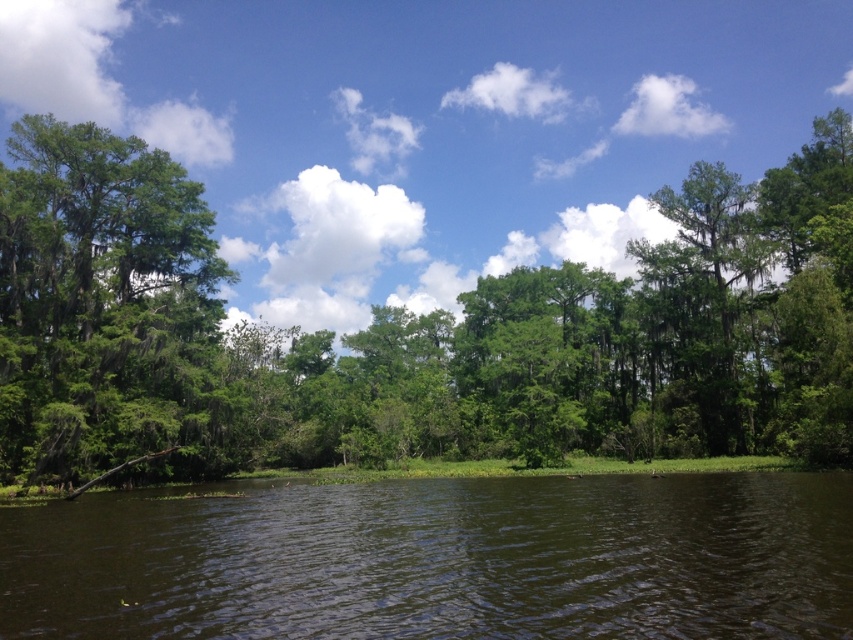
Looking at this image, does green leafy forest at center appear on the right side of green mossy tree at left?

Yes, green leafy forest at center is to the right of green mossy tree at left.

Who is taller, green leafy forest at center or green mossy tree at left?

With more height is green leafy forest at center.

Locate an element on the screen. This screenshot has height=640, width=853. green leafy forest at center is located at coordinates (415, 333).

I want to click on green leafy forest at center, so click(x=415, y=333).

Who is more distant from viewer, (16, 372) or (172, 596)?

Positioned behind is point (16, 372).

Who is lower down, green leafy forest at center or green grass at lower center?

green grass at lower center is below.

At what (x,y) coordinates should I click in order to perform the action: click on green leafy forest at center. Please return your answer as a coordinate pair (x, y). Looking at the image, I should click on (415, 333).

The width and height of the screenshot is (853, 640). Find the location of `green leafy forest at center`. green leafy forest at center is located at coordinates (415, 333).

Who is positioned more to the left, green grass at lower center or green mossy tree at left?

green mossy tree at left is more to the left.

This screenshot has height=640, width=853. Identify the location of green grass at lower center. point(440,560).